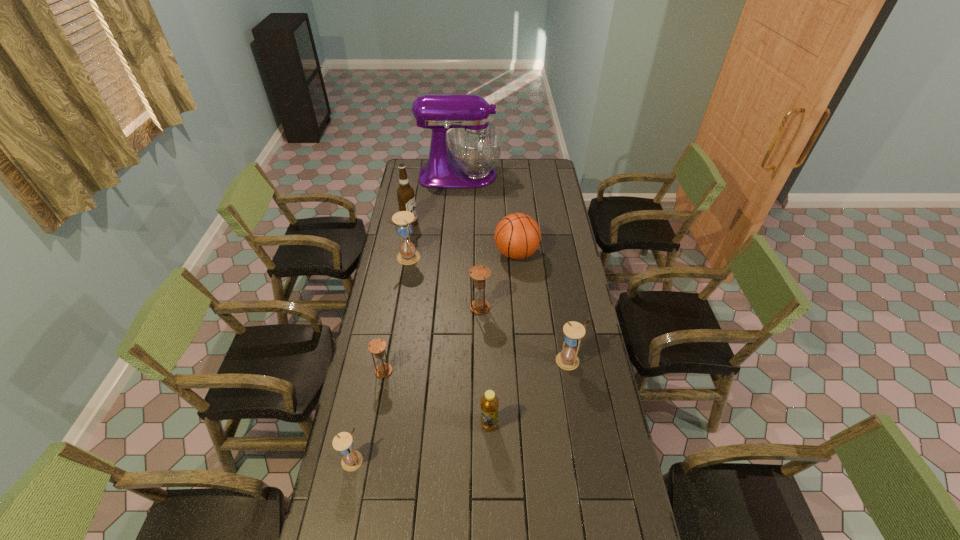
Locate an element on the screen. This screenshot has width=960, height=540. vacant area located 0.140m on the left of the right brown hourglass is located at coordinates (437, 307).

At what (x,y) coordinates should I click in order to perform the action: click on vacant space located on the back of the rightmost object. Please return your answer as a coordinate pair (x, y). Looking at the image, I should click on (557, 287).

Where is `vacant space situated on the front of the eighth farthest object`? vacant space situated on the front of the eighth farthest object is located at coordinates (490, 453).

Identify the location of vacant region located 0.370m on the right of the smaller brown hourglass. The image size is (960, 540). (490, 371).

The height and width of the screenshot is (540, 960). Identify the location of vacant position located on the front of the nearest hourglass. (345, 498).

Image resolution: width=960 pixels, height=540 pixels. I want to click on object situated at the far edge, so click(475, 144).

The height and width of the screenshot is (540, 960). I want to click on mixer positioned at the left edge, so click(475, 144).

In order to click on alcohol that is positioned at the left edge in this screenshot , I will do `click(405, 193)`.

Locate an element on the screen. object at the right edge is located at coordinates (567, 359).

In order to click on object that is at the far left corner in this screenshot , I will do `click(475, 144)`.